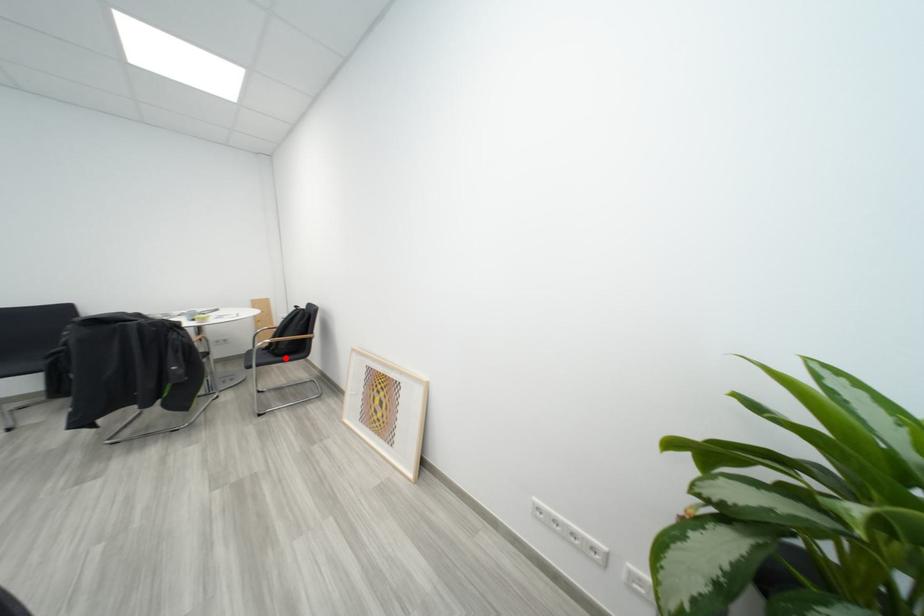
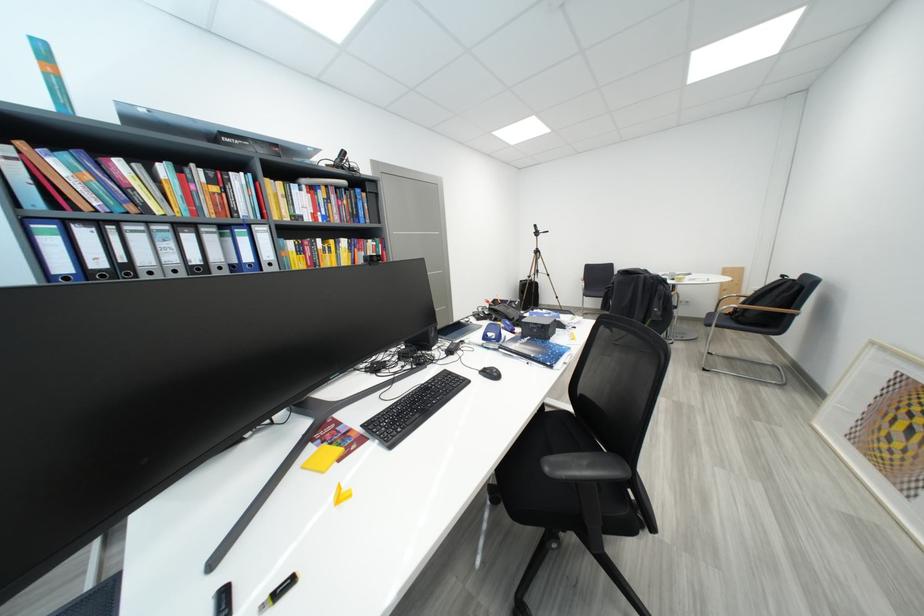
Question: I am providing you with two images of the same scene from different viewpoints. Given a red point in image1, look at the same physical point in image2. Is it:

Choices:
 (A) Closer to the viewpoint
 (B) Farther from the viewpoint

Answer: (A)